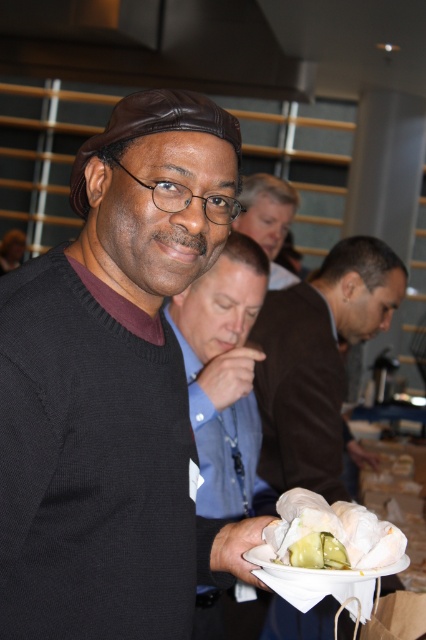
You are at the gathering and want to reach the point marked as point (333, 380). If your walking speed is 3 feet per second, how many seconds will it take you to reach that point?

The distance between you and point (333, 380) is 6.80 feet. At a walking speed of 3 feet per second, it will take approximately 2.27 seconds to reach the point.

You are standing at the entrance of the event and see the brown leather jacket at center and the matte black sweater at center. Which one is higher up in your field of view?

Result: The brown leather jacket at center is located above the matte black sweater at center, so it is higher up in your field of view.